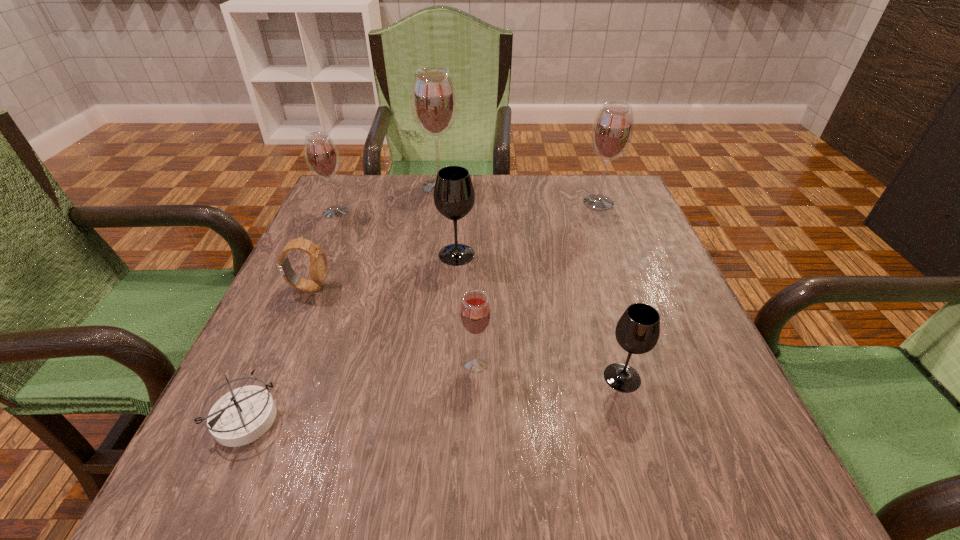
Find the location of a particular element. vacant region that satisfies the following two spatial constraints: 1. on the back side of the smaller gray wineglass; 2. on the left side of the second tallest object is located at coordinates (571, 202).

Find the location of a particular element. The image size is (960, 540). free spot that satisfies the following two spatial constraints: 1. on the front side of the smaller gray wineglass; 2. on the left side of the third biggest red wineglass is located at coordinates (261, 377).